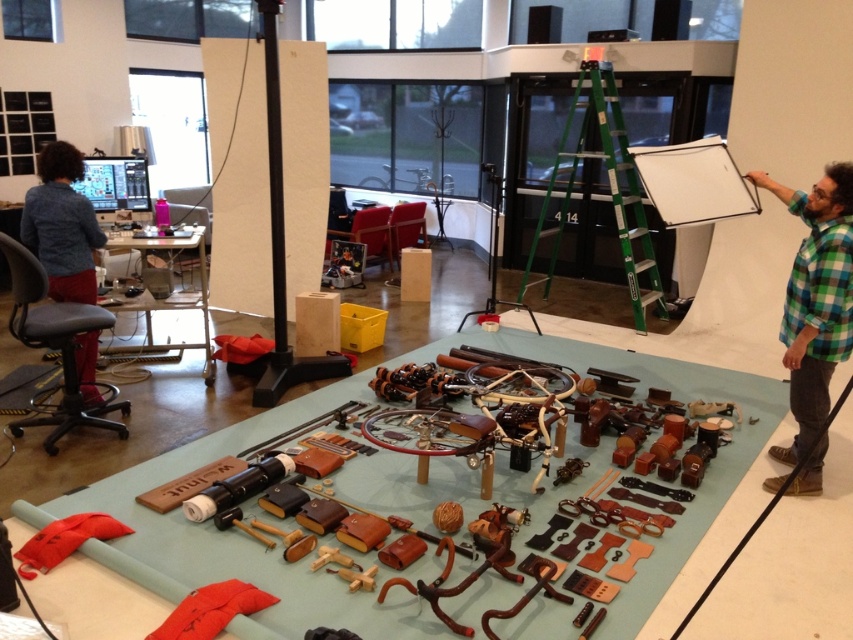
Question: Which point is farther to the camera?

Choices:
 (A) green plaid shirt at right
 (B) green metallic ladder at upper center

Answer: (B)

Question: Is green plaid shirt at right positioned behind blue denim shirt at left?

Choices:
 (A) no
 (B) yes

Answer: (A)

Question: Considering the real-world distances, which object is farthest from the green plaid shirt at right?

Choices:
 (A) green metallic ladder at upper center
 (B) blue denim shirt at left

Answer: (B)

Question: Does green plaid shirt at right lie behind blue denim shirt at left?

Choices:
 (A) no
 (B) yes

Answer: (A)

Question: Which point is closer to the camera taking this photo?

Choices:
 (A) (67, 230)
 (B) (614, 195)

Answer: (A)

Question: Can you confirm if green plaid shirt at right is wider than green metallic ladder at upper center?

Choices:
 (A) yes
 (B) no

Answer: (B)